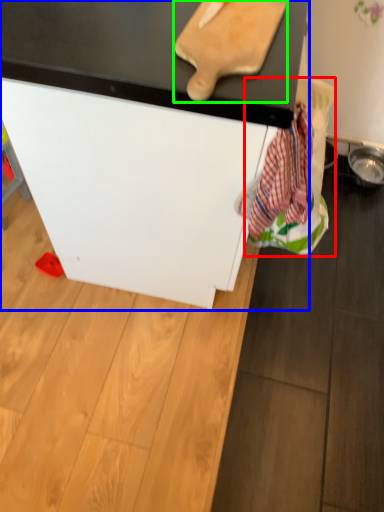
Question: Which object is positioned farthest from laundry (highlighted by a red box)? Select from furniture (highlighted by a blue box) and cutting board (highlighted by a green box).

Choices:
 (A) furniture
 (B) cutting board

Answer: (B)